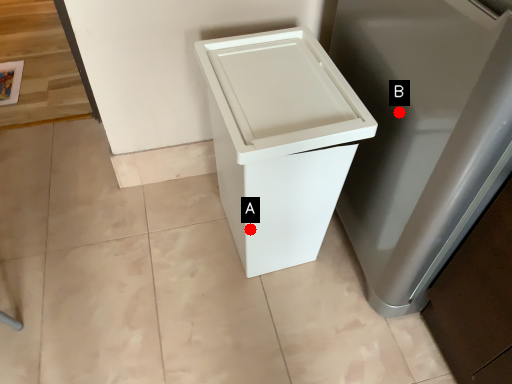
Question: Two points are circled on the image, labeled by A and B beside each circle. Which point is closer to the camera?

Choices:
 (A) A is closer
 (B) B is closer

Answer: (B)